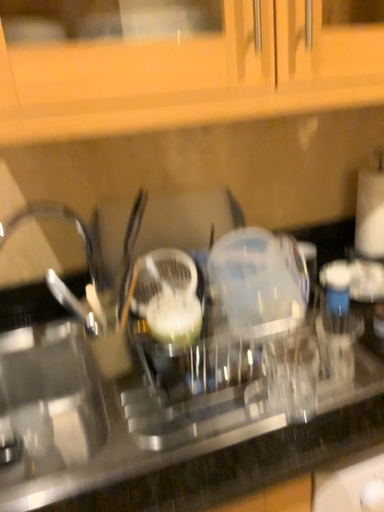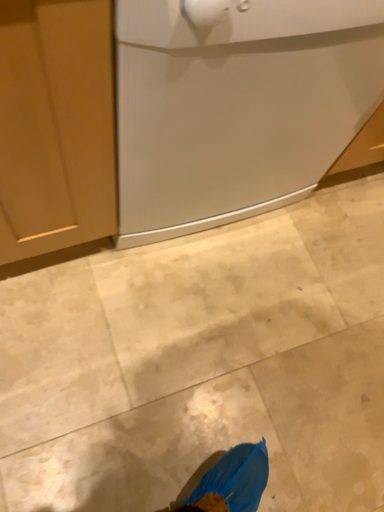
Question: How did the camera likely rotate when shooting the video?

Choices:
 (A) rotated downward
 (B) rotated upward

Answer: (A)